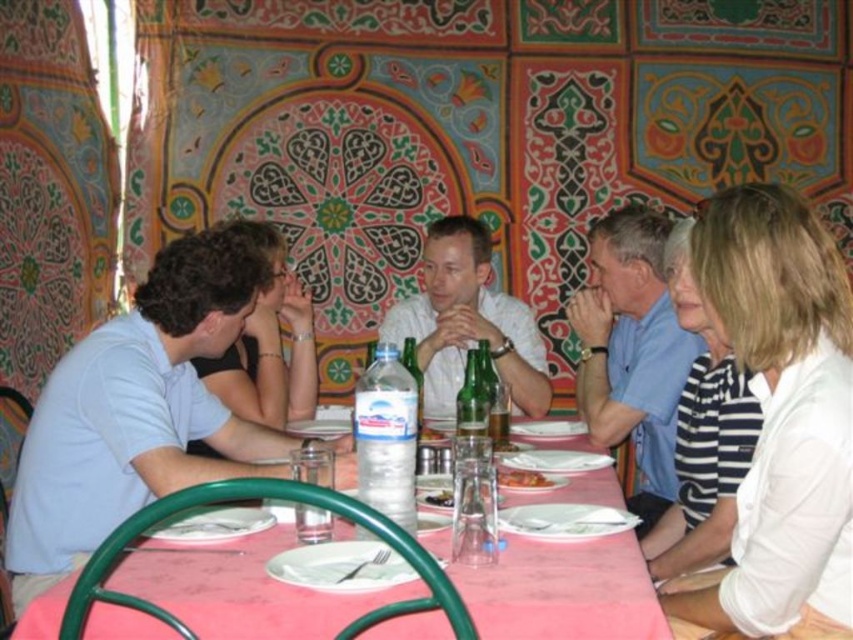
Is white cotton shirt at upper right bigger than white matte shirt at center?

Actually, white cotton shirt at upper right might be smaller than white matte shirt at center.

Is point (741, 572) more distant than point (395, 332)?

No, (741, 572) is in front of (395, 332).

Find the location of a particular element. The image size is (853, 640). white cotton shirt at upper right is located at coordinates (781, 416).

Is white cotton shirt at upper right to the left of blue cotton shirt at upper right from the viewer's perspective?

In fact, white cotton shirt at upper right is to the right of blue cotton shirt at upper right.

Is white cotton shirt at upper right to the right of blue cotton shirt at upper right from the viewer's perspective?

Correct, you'll find white cotton shirt at upper right to the right of blue cotton shirt at upper right.

Which is in front, point (763, 204) or point (584, 417)?

Point (763, 204)

You are a GUI agent. You are given a task and a screenshot of the screen. Output one action in this format:
    pyautogui.click(x=<x>, y=<y>)
    Task: Click on the white cotton shirt at upper right
    
    Given the screenshot: What is the action you would take?
    pyautogui.click(x=781, y=416)

Identify the location of pink fabric table at center. The image size is (853, 640). (560, 589).

Find the location of a particular element. Image resolution: width=853 pixels, height=640 pixels. pink fabric table at center is located at coordinates click(560, 589).

Locate an element on the screen. The image size is (853, 640). pink fabric table at center is located at coordinates (560, 589).